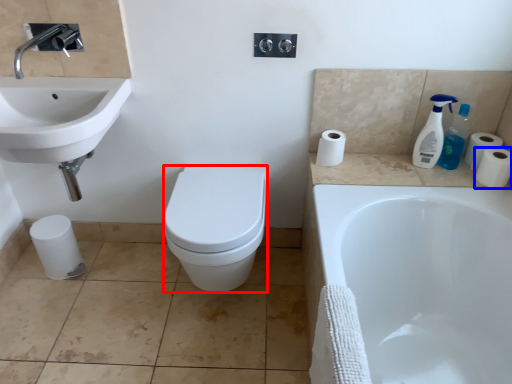
Question: Which object appears closest to the camera in this image, bidet (highlighted by a red box) or toilet paper (highlighted by a blue box)?

Choices:
 (A) bidet
 (B) toilet paper

Answer: (A)